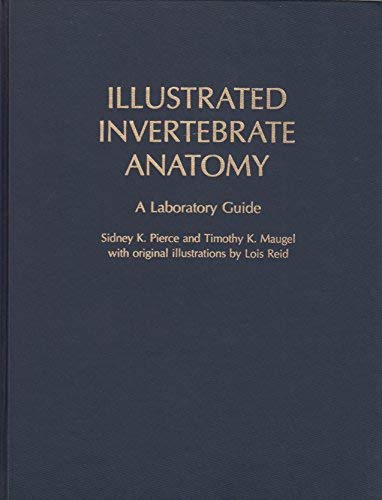
Identify the location of corner. The height and width of the screenshot is (500, 382). point(380,3), point(375,498).